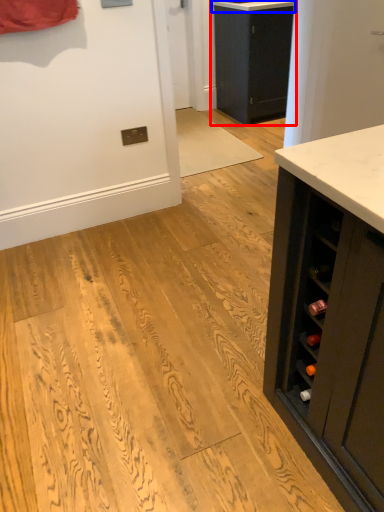
Question: Which object is further to the camera taking this photo, cabinetry (highlighted by a red box) or counter top (highlighted by a blue box)?

Choices:
 (A) cabinetry
 (B) counter top

Answer: (A)